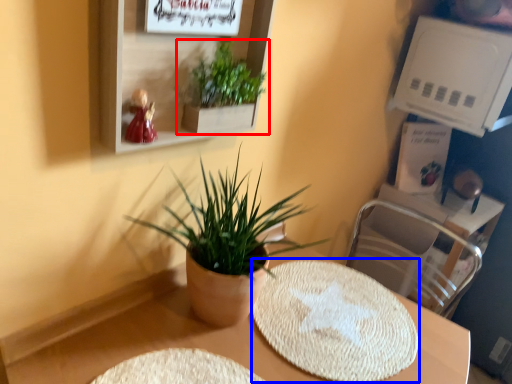
Question: Which object is closer to the camera taking this photo, houseplant (highlighted by a red box) or mat (highlighted by a blue box)?

Choices:
 (A) houseplant
 (B) mat

Answer: (A)